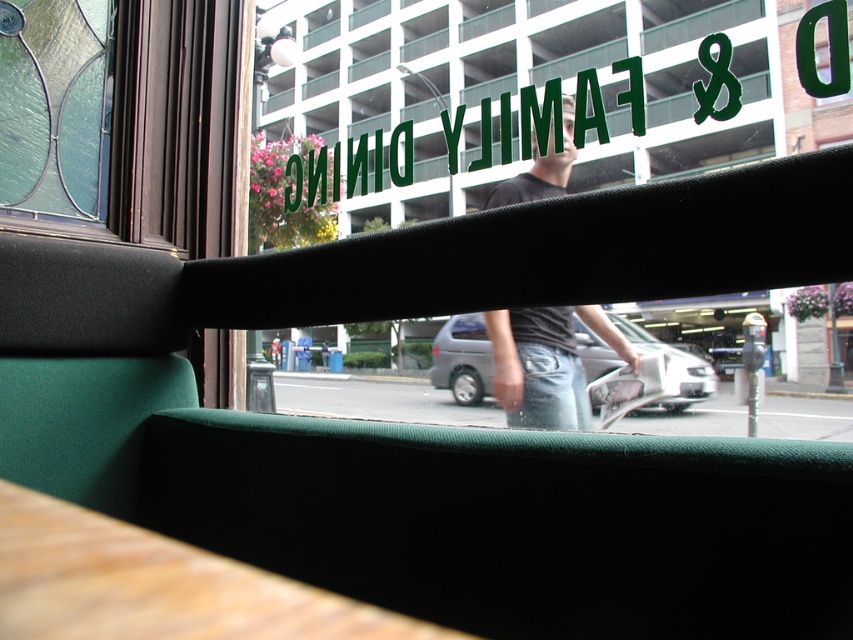
Question: Is wooden table at lower left further to the viewer compared to dark gray jeans at center?

Choices:
 (A) yes
 (B) no

Answer: (B)

Question: From the image, what is the correct spatial relationship of wooden table at lower left in relation to clear glass window at upper left?

Choices:
 (A) left
 (B) right

Answer: (B)

Question: Which object is closer to the camera taking this photo?

Choices:
 (A) wooden table at lower left
 (B) green fabric window at center
 (C) clear glass window at upper left
 (D) dark gray jeans at center

Answer: (A)

Question: Which of the following is the closest to the observer?

Choices:
 (A) clear glass window at upper left
 (B) dark gray jeans at center
 (C) green fabric window at center

Answer: (C)

Question: Which point is farther from the camera taking this photo?

Choices:
 (A) (553, 348)
 (B) (634, 150)
 (C) (94, 166)

Answer: (B)

Question: Does green fabric window at center lie behind clear glass window at upper left?

Choices:
 (A) yes
 (B) no

Answer: (B)